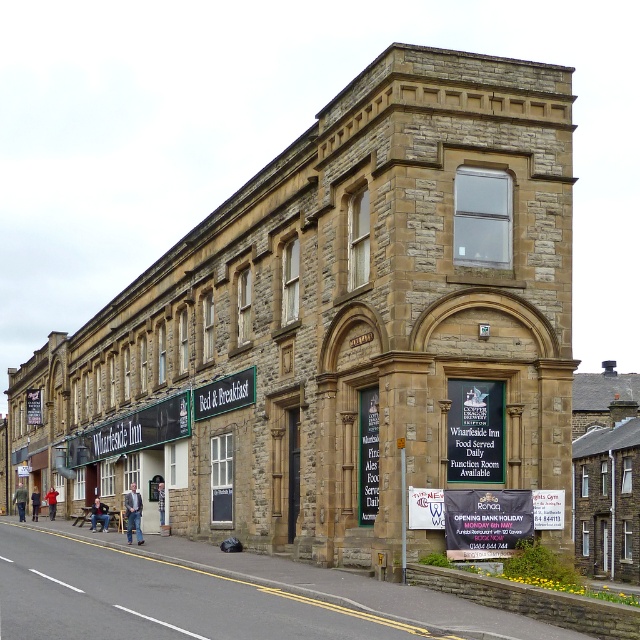
Question: Is white plastic banner at lower center thinner than greensignboard at center?

Choices:
 (A) yes
 (B) no

Answer: (A)

Question: Which point is farther to the camera?

Choices:
 (A) greensignboard at center
 (B) white plastic banner at lower center

Answer: (A)

Question: Which object appears closest to the camera in this image?

Choices:
 (A) white plastic banner at lower center
 (B) greensignboard at center

Answer: (A)

Question: Does white plastic banner at lower center have a smaller size compared to greensignboard at center?

Choices:
 (A) no
 (B) yes

Answer: (B)

Question: Does white plastic banner at lower center appear on the left side of greensignboard at center?

Choices:
 (A) no
 (B) yes

Answer: (A)

Question: Which object appears closest to the camera in this image?

Choices:
 (A) greensignboard at center
 (B) white plastic banner at lower center

Answer: (B)